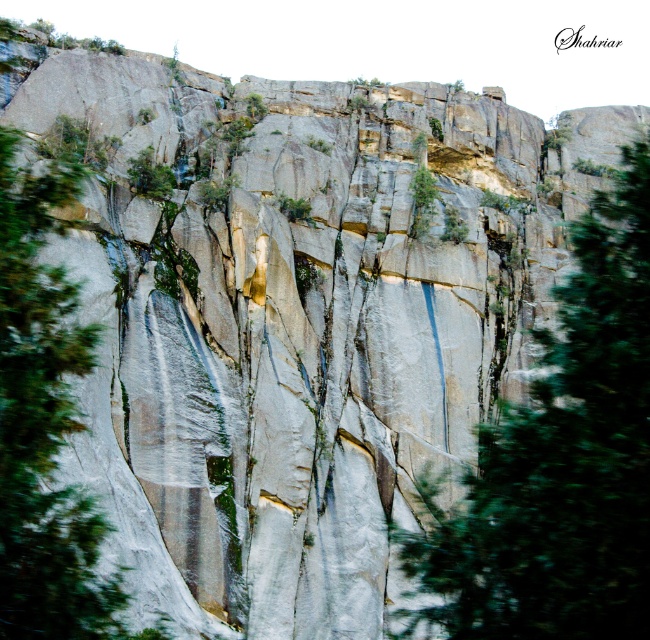
You are a hiker trying to navigate between two green leafy trees. The path leads you from the smaller tree to the larger one. Which direction should you head to reach the larger green leafy tree at center from the green leafy tree at left?

The green leafy tree at center is larger than the green leafy tree at left. To reach the larger tree from the smaller one, you should head towards the center direction.

You are a hiker standing at the base of the towering rock formation. You see two green leafy trees in the scene. Which tree, the green leafy tree at center or the green leafy tree at left, is closer to you?

The green leafy tree at center is closer to you because it is positioned in front of the green leafy tree at left.

You are standing at the base of the towering rock formation and want to reach the green leafy tree at center. Which direction should you move relative to your current position?

The green leafy tree at center is located at point coordinates, so you should move towards the center of the rock formation to reach it.